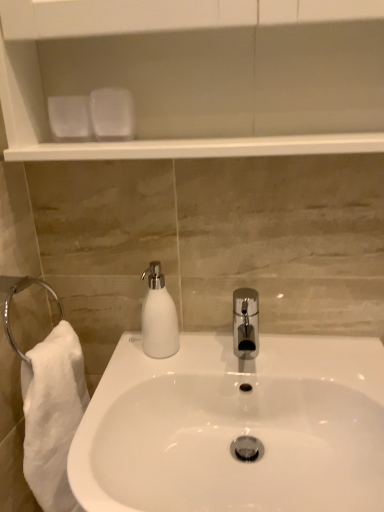
Find the location of a particular element. This screenshot has height=512, width=384. free space to the left of white matte soap dispenser at center is located at coordinates (123, 354).